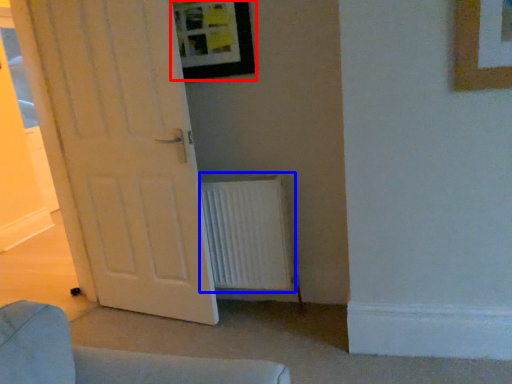
Question: Which object is further to the camera taking this photo, picture frame (highlighted by a red box) or radiator (highlighted by a blue box)?

Choices:
 (A) picture frame
 (B) radiator

Answer: (B)